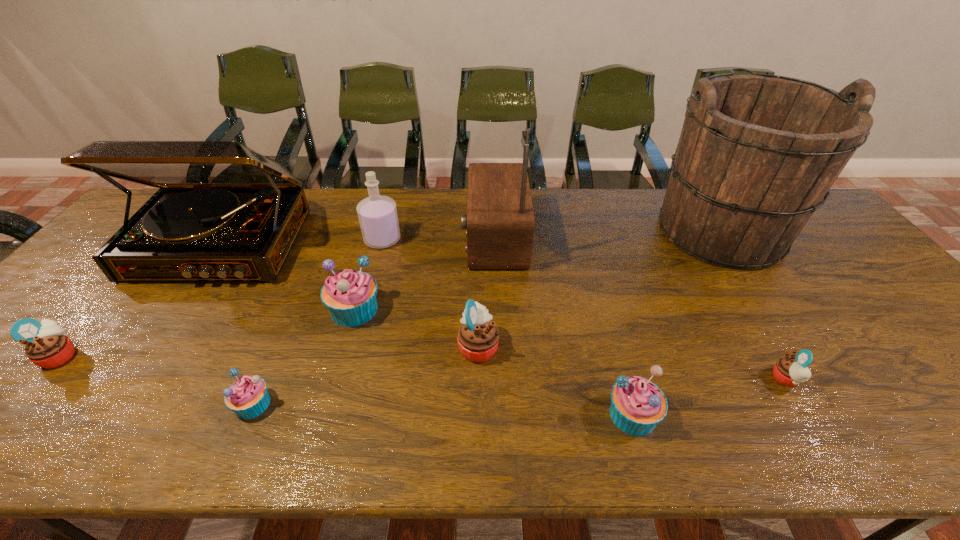
What are the coordinates of `free space located 0.260m on the left of the eighth object from right to left` in the screenshot? It's located at (110, 404).

At what (x,y) coordinates should I click in order to perform the action: click on bucket at the far edge. Please return your answer as a coordinate pair (x, y). Looking at the image, I should click on (757, 153).

Find the location of a particular element. Image resolution: width=960 pixels, height=540 pixels. radio receiver that is at the far edge is located at coordinates (500, 221).

You are a GUI agent. You are given a task and a screenshot of the screen. Output one action in this format:
    pyautogui.click(x=<x>, y=<y>)
    Task: Click on the record player that is at the far edge
    Image resolution: width=960 pixels, height=540 pixels.
    Given the screenshot: What is the action you would take?
    pyautogui.click(x=224, y=212)

The height and width of the screenshot is (540, 960). Identify the location of perfume situated at the far edge. (377, 214).

Find the location of `record player situated at the left edge`. record player situated at the left edge is located at coordinates (224, 212).

This screenshot has width=960, height=540. I want to click on muffin at the left edge, so click(47, 345).

Locate an element on the screen. object situated at the right edge is located at coordinates (757, 153).

You are a GUI agent. You are given a task and a screenshot of the screen. Output one action in this format:
    pyautogui.click(x=<x>, y=<y>)
    Task: Click on the object at the far left corner
    The width and height of the screenshot is (960, 540).
    Given the screenshot: What is the action you would take?
    [224, 212]

Where is `object that is at the far right corner`? object that is at the far right corner is located at coordinates (757, 153).